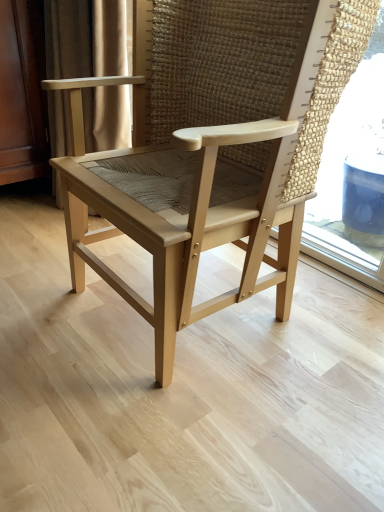
Identify the location of vacant space in natural wood chair at center (from a real-world perspective). This screenshot has width=384, height=512. (192, 325).